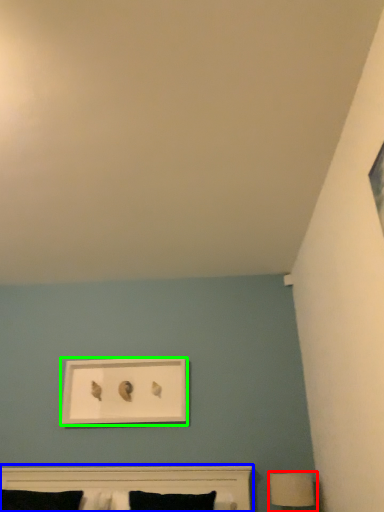
Question: Based on their relative distances, which object is nearer to table lamp (highlighted by a red box)? Choose from bed (highlighted by a blue box) and picture frame (highlighted by a green box).

Choices:
 (A) bed
 (B) picture frame

Answer: (A)